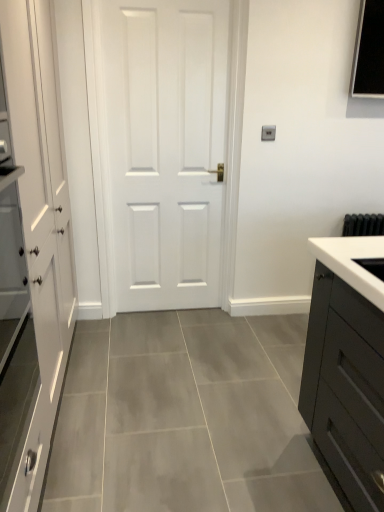
Question: Is white glossy sink at right wider or thinner than white matte cabinet at left?

Choices:
 (A) wide
 (B) thin

Answer: (B)

Question: Is white glossy sink at right situated inside white matte cabinet at left or outside?

Choices:
 (A) outside
 (B) inside

Answer: (A)

Question: Which object is the closest to the white matte door at center?

Choices:
 (A) white matte cabinet at left
 (B) white glossy sink at right

Answer: (A)

Question: Which of these objects is positioned closest to the white glossy sink at right?

Choices:
 (A) white matte door at center
 (B) white matte cabinet at left

Answer: (B)